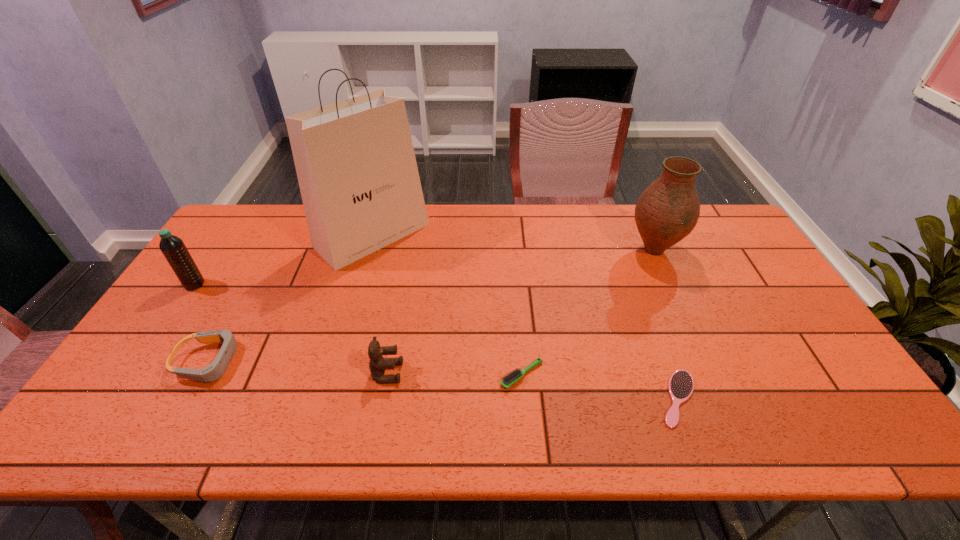
At what (x,y) coordinates should I click in order to perform the action: click on vacant space that satisfies the following two spatial constraints: 1. on the face of the teddy bear; 2. on the left side of the right hairbrush. Please return your answer as a coordinate pair (x, y). This screenshot has height=540, width=960. Looking at the image, I should click on (382, 398).

Where is `vacant space that satisfies the following two spatial constraints: 1. on the front side of the tallest object; 2. on the left side of the vase`? This screenshot has height=540, width=960. vacant space that satisfies the following two spatial constraints: 1. on the front side of the tallest object; 2. on the left side of the vase is located at coordinates (369, 250).

Where is `free region that satisfies the following two spatial constraints: 1. on the front side of the right hairbrush; 2. on the left side of the left hairbrush`? Image resolution: width=960 pixels, height=540 pixels. free region that satisfies the following two spatial constraints: 1. on the front side of the right hairbrush; 2. on the left side of the left hairbrush is located at coordinates (524, 398).